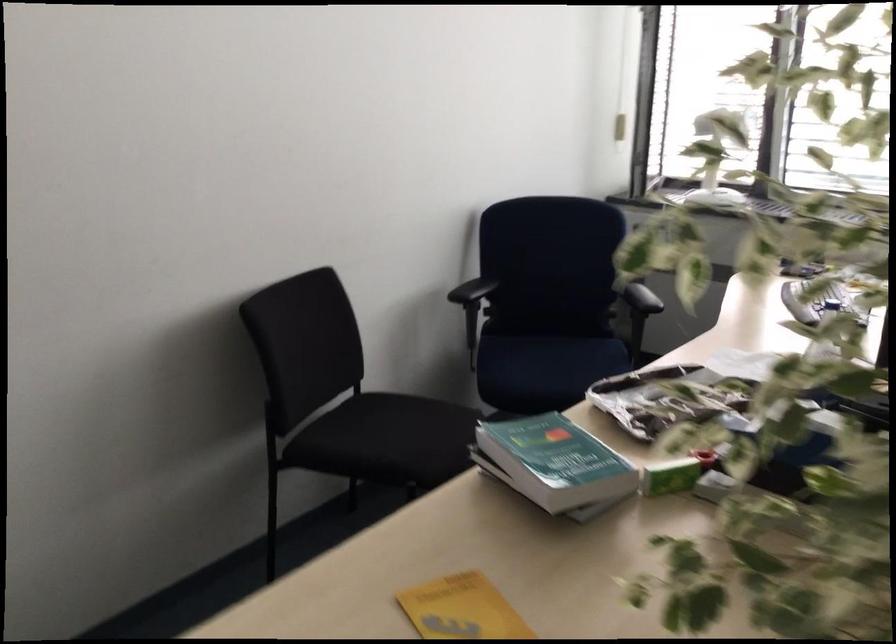
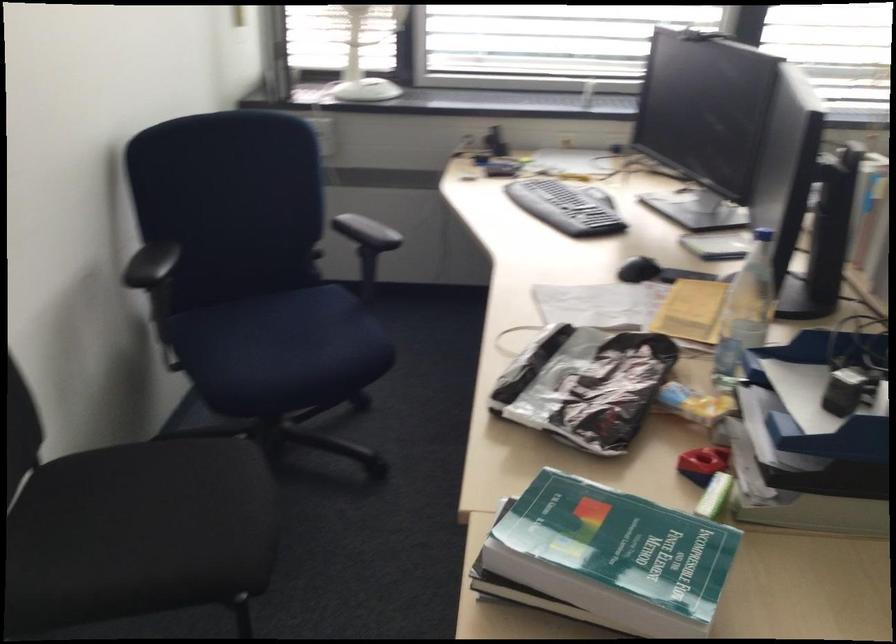
Question: I am providing you with two images of the same scene from different viewpoints. Please identify which objects are invisible in image2.

Choices:
 (A) blue chair sitting surface
 (B) black computer mouse
 (C) green hardcover book
 (D) none of these

Answer: (D)